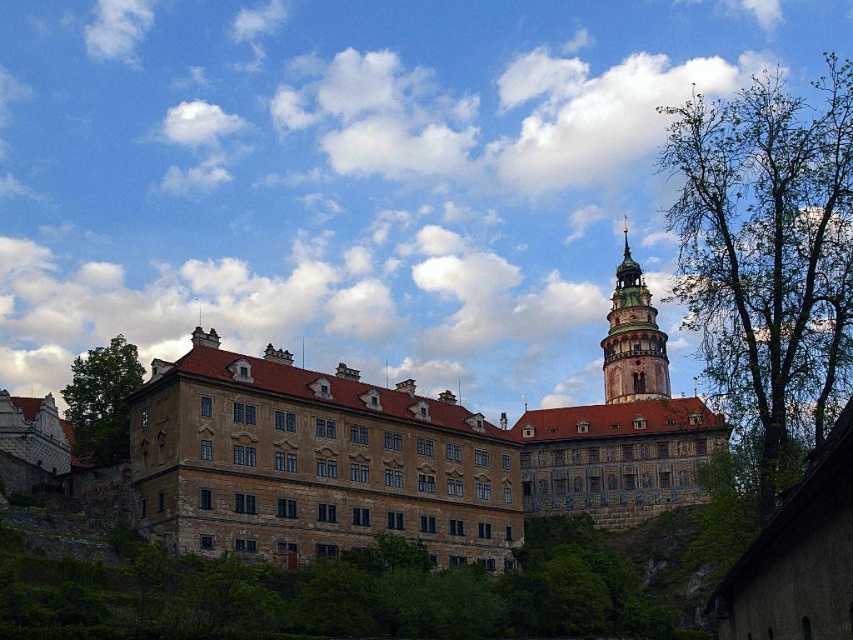
Is the position of brown stone castle at center more distant than that of green leafy tree at left?

That is False.

Is point (287, 376) less distant than point (73, 376)?

Yes, it is.

Identify the location of brown stone castle at center. (404, 452).

Which of these two, brown stone castle at center or green leafy tree at right, stands taller?

green leafy tree at right

Does point (653, 400) come in front of point (757, 465)?

No.

Does point (281, 408) lie behind point (843, 307)?

Yes, point (281, 408) is farther from viewer.

Where is `brown stone castle at center`? This screenshot has width=853, height=640. brown stone castle at center is located at coordinates (404, 452).

Based on the photo, can you confirm if green leafy tree at left is positioned to the right of green wooden tower at upper center?

In fact, green leafy tree at left is to the left of green wooden tower at upper center.

The height and width of the screenshot is (640, 853). Describe the element at coordinates (102, 401) in the screenshot. I see `green leafy tree at left` at that location.

What are the coordinates of `green leafy tree at left` in the screenshot? It's located at (x=102, y=401).